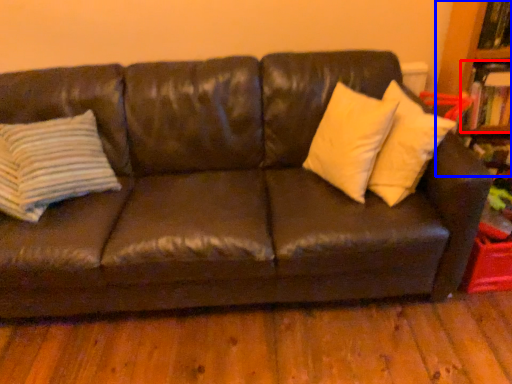
Question: Which point is further to the camera, book (highlighted by a red box) or bookcase (highlighted by a blue box)?

Choices:
 (A) book
 (B) bookcase

Answer: (A)